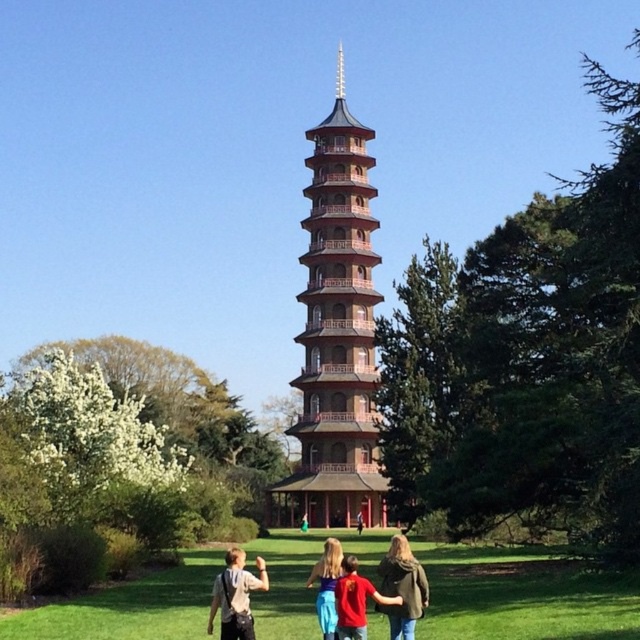
Question: Is green grass at lower center below green fabric dress at center?

Choices:
 (A) no
 (B) yes

Answer: (A)

Question: Where is blue denim jeans at center located in relation to green fabric dress at center in the image?

Choices:
 (A) right
 (B) left

Answer: (A)

Question: Estimate the real-world distances between objects in this image. Which object is farther from the red shirt at center?

Choices:
 (A) denim jacket at lower center
 (B) matte black backpack at lower center
 (C) blue denim jeans at center

Answer: (C)

Question: From the image, what is the correct spatial relationship of denim jacket at lower center in relation to blue denim jeans at center?

Choices:
 (A) below
 (B) above

Answer: (B)

Question: Which object is farther from the camera taking this photo?

Choices:
 (A) blue denim jeans at center
 (B) denim jacket at lower center
 (C) blonde hair at center
 (D) matte black backpack at lower center

Answer: (A)

Question: Which point is closer to the camera?

Choices:
 (A) green fabric dress at center
 (B) blue denim jeans at center
 (C) matte pink pagoda at center
 (D) denim jacket at lower center

Answer: (D)